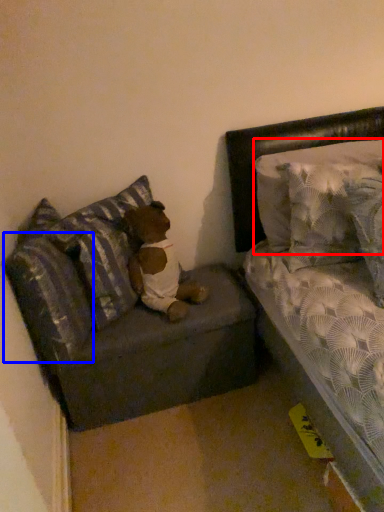
Question: Which point is closer to the camera, pillow (highlighted by a red box) or pillow (highlighted by a blue box)?

Choices:
 (A) pillow
 (B) pillow

Answer: (B)